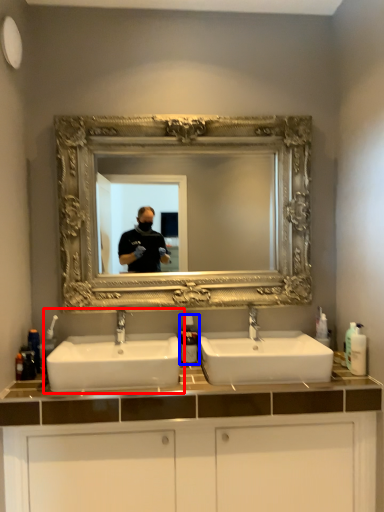
Question: Which object appears closest to the camera in this image, sink (highlighted by a red box) or soap dispenser (highlighted by a blue box)?

Choices:
 (A) sink
 (B) soap dispenser

Answer: (A)